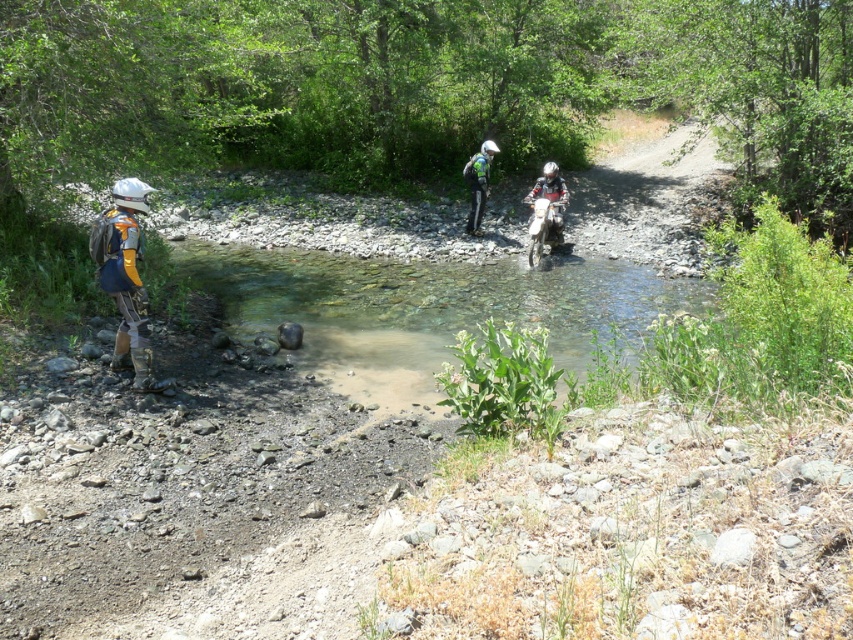
You are a hiker planning to cross the stream in the forest. You see two helmets, the matte silver helmet at left and the green matte helmet at center. If you want to place a 10 meter long rope between them to create a safety line, will the rope be sufficient?

The matte silver helmet at left and the green matte helmet at center are 9.40 meters apart. A 10 meter long rope would be sufficient to span the distance between them, as it is longer than the 9.40 meters required.

You are navigating through the forest and need to cross the stream. There are two points marked on the map as point 1 at coordinates point (x=125, y=192) and point 2 at coordinates point (x=473, y=180). Which point should you approach first if you want to cross the stream in the shortest path possible?

Point 1 at coordinates point (x=125, y=192) should be approached first because it is in front of point 2 at coordinates point (x=473, y=180), making it closer to the starting position for crossing the stream.